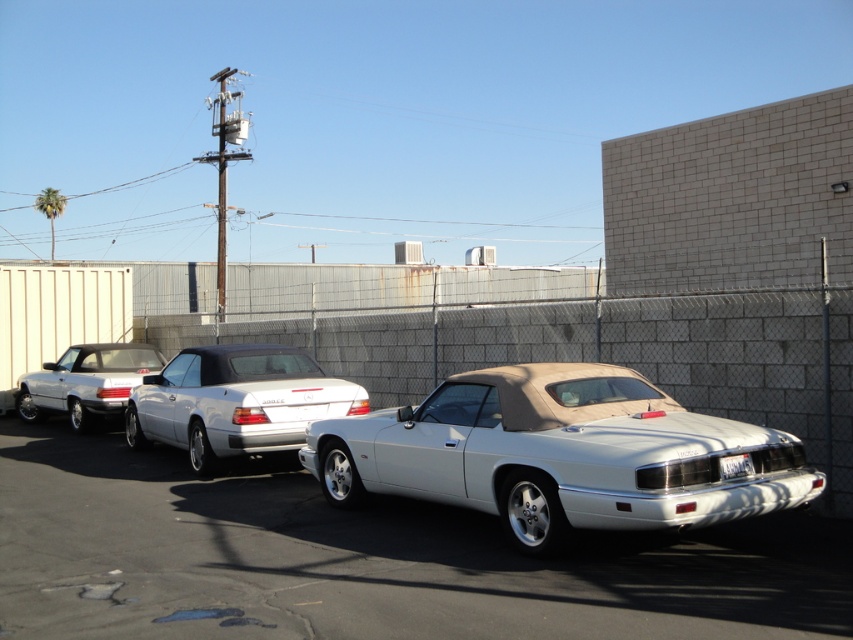
Is metallic chain-link fence at center below white matte sedan at left?

No, metallic chain-link fence at center is not below white matte sedan at left.

Based on the photo, is metallic chain-link fence at center shorter than white matte sedan at left?

No.

You are a GUI agent. You are given a task and a screenshot of the screen. Output one action in this format:
    pyautogui.click(x=<x>, y=<y>)
    Task: Click on the metallic chain-link fence at center
    Image resolution: width=853 pixels, height=640 pixels.
    Given the screenshot: What is the action you would take?
    coord(595,353)

Who is more distant from viewer, (71,401) or (741,465)?

The point (71,401) is more distant.

Who is shorter, white matte sedan at left or white plastic license plate at rear?

white plastic license plate at rear is shorter.

You are a GUI agent. You are given a task and a screenshot of the screen. Output one action in this format:
    pyautogui.click(x=<x>, y=<y>)
    Task: Click on the white matte sedan at left
    The width and height of the screenshot is (853, 640).
    Given the screenshot: What is the action you would take?
    pyautogui.click(x=85, y=381)

You are a GUI agent. You are given a task and a screenshot of the screen. Output one action in this format:
    pyautogui.click(x=<x>, y=<y>)
    Task: Click on the white matte sedan at left
    
    Given the screenshot: What is the action you would take?
    pyautogui.click(x=85, y=381)

Image resolution: width=853 pixels, height=640 pixels. Describe the element at coordinates (560, 454) in the screenshot. I see `white matte convertible at center` at that location.

Based on the photo, does white matte convertible at center appear over white glossy sedan at center?

Actually, white matte convertible at center is below white glossy sedan at center.

Where is `white matte convertible at center`? white matte convertible at center is located at coordinates (560, 454).